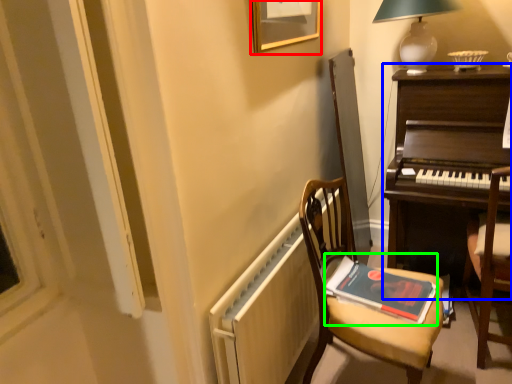
Question: Based on their relative distances, which object is nearer to picture frame (highlighted by a red box)? Choose from desk (highlighted by a blue box) and paperback book (highlighted by a green box).

Choices:
 (A) desk
 (B) paperback book

Answer: (A)